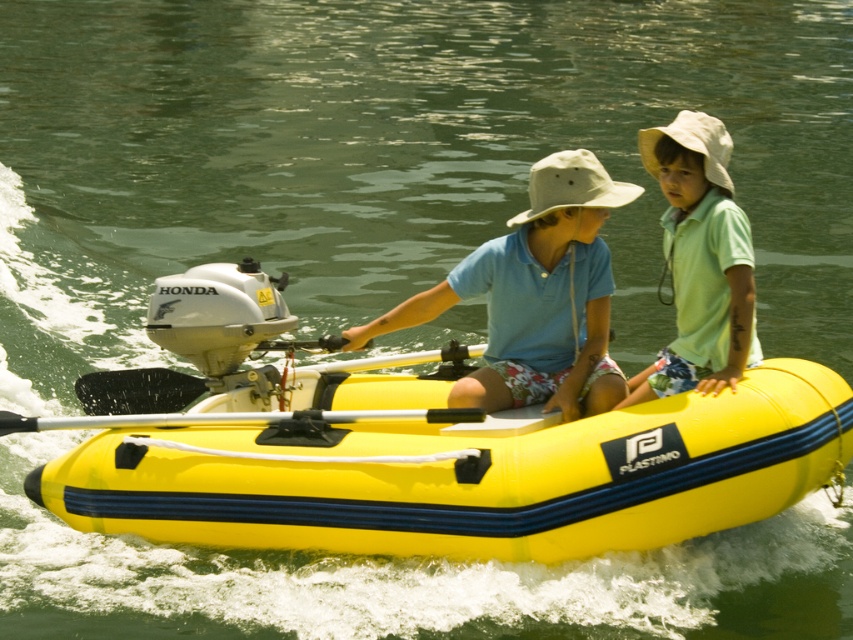
Does matte blue shirt at center have a larger size compared to green matte shirt at upper right?

Indeed, matte blue shirt at center has a larger size compared to green matte shirt at upper right.

Based on the photo, who is taller, matte blue shirt at center or green matte shirt at upper right?

matte blue shirt at center is taller.

Does point (670, 145) come in front of point (682, 356)?

That is True.

This screenshot has width=853, height=640. Identify the location of matte blue shirt at center. (697, 264).

Does green matte shirt at upper right appear under white rubber paddle at center?

No.

Looking at this image, can you confirm if green matte shirt at upper right is wider than white rubber paddle at center?

In fact, green matte shirt at upper right might be narrower than white rubber paddle at center.

Identify the location of green matte shirt at upper right. The height and width of the screenshot is (640, 853). (699, 260).

Measure the distance between matte blue shirt at center and camera.

matte blue shirt at center and camera are 31.27 feet apart from each other.

What do you see at coordinates (697, 264) in the screenshot?
I see `matte blue shirt at center` at bounding box center [697, 264].

Is point (676, 170) positioned before point (186, 392)?

Yes, point (676, 170) is closer to viewer.

The width and height of the screenshot is (853, 640). In order to click on matte blue shirt at center in this screenshot , I will do `click(697, 264)`.